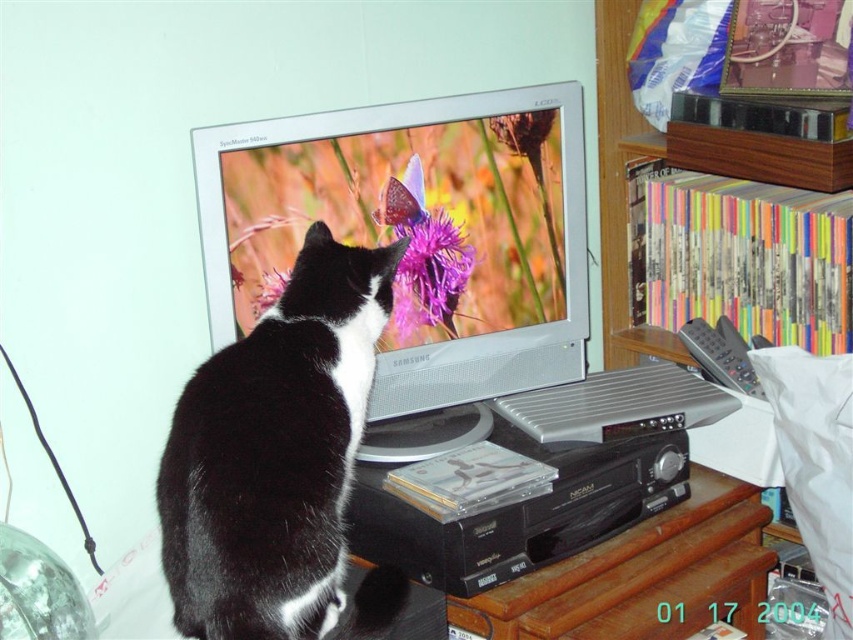
Between black and white fur cat at left and gray plastic remote at right, which one is positioned higher?

gray plastic remote at right is higher up.

Between black and white fur cat at left and gray plastic remote at right, which one appears on the left side from the viewer's perspective?

black and white fur cat at left is more to the left.

At what (x,y) coordinates should I click in order to perform the action: click on black and white fur cat at left. Please return your answer as a coordinate pair (x, y). The width and height of the screenshot is (853, 640). Looking at the image, I should click on (274, 452).